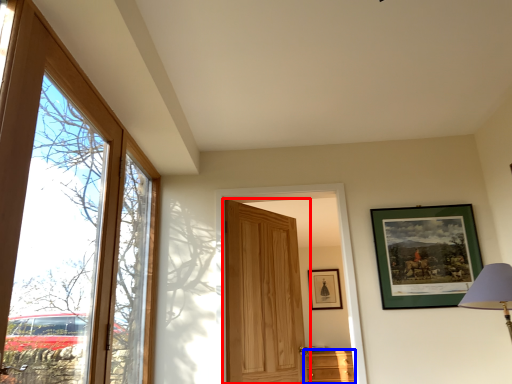
Question: Which point is closer to the camera, door (highlighted by a red box) or cabinetry (highlighted by a blue box)?

Choices:
 (A) door
 (B) cabinetry

Answer: (A)